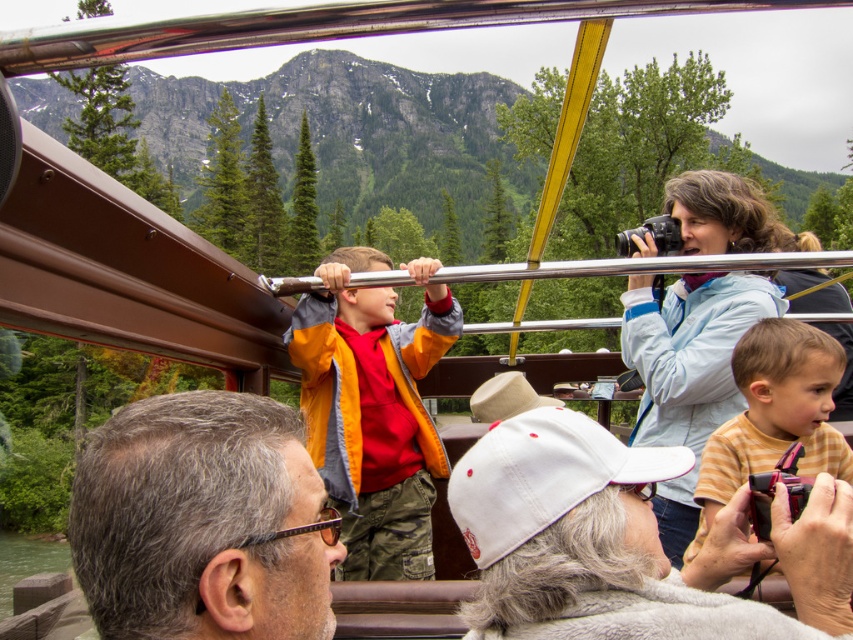
You are standing on the tour boat and want to take a photo of both the light blue jacket at upper right and the yellow striped shirt at center. Which one should you adjust your camera focus to first to ensure both are in the frame?

You should focus on the light blue jacket at upper right first since it is closer to you than the yellow striped shirt at center, allowing you to adjust the camera to include both in the frame.